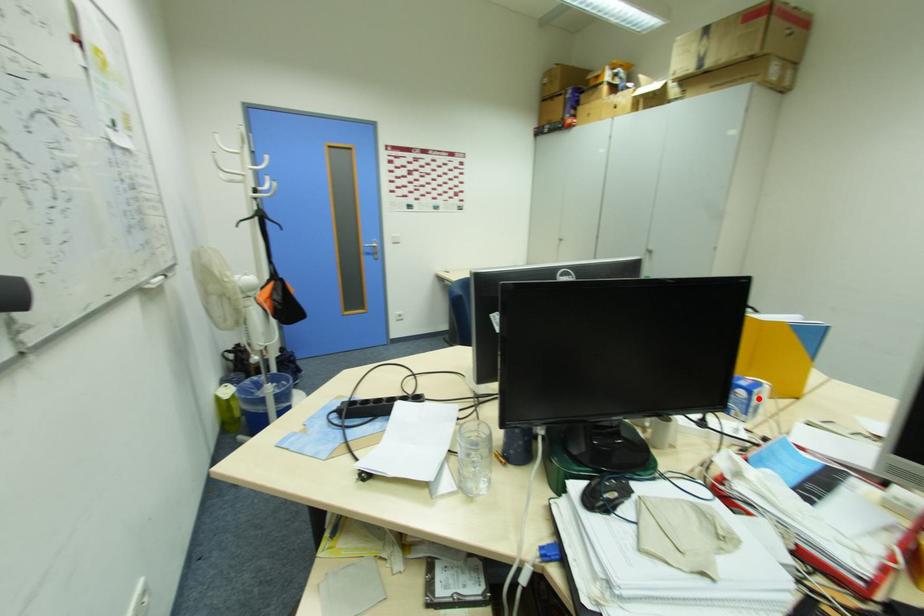
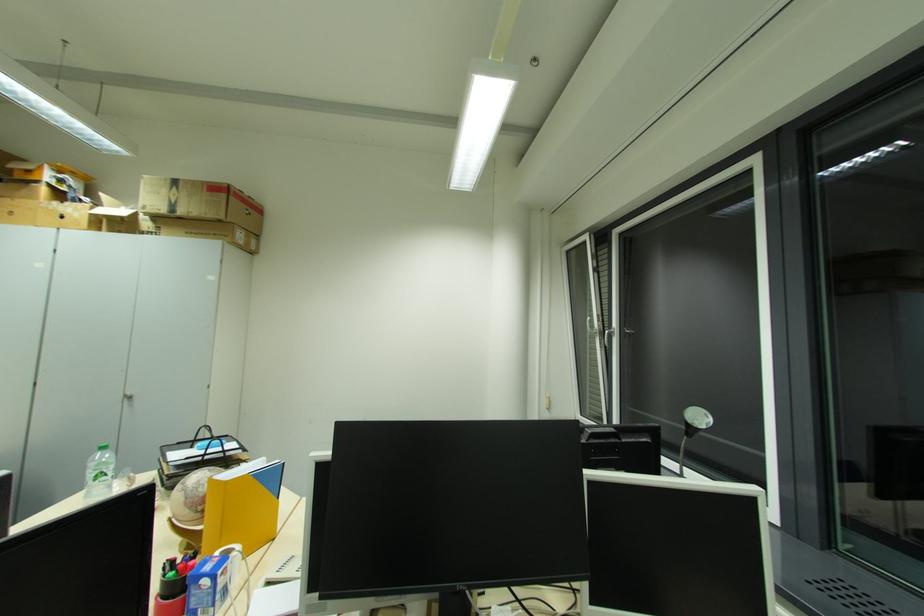
Find the pixel in the second image that matches the highlighted location in the first image.

(223, 582)